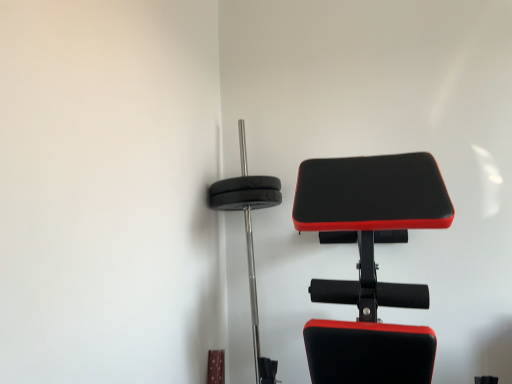
This screenshot has height=384, width=512. Describe the element at coordinates (371, 261) in the screenshot. I see `black leather bench at center` at that location.

Where is `black leather bench at center`? This screenshot has height=384, width=512. black leather bench at center is located at coordinates (371, 261).

This screenshot has width=512, height=384. In order to click on black leather bench at center in this screenshot , I will do `click(371, 261)`.